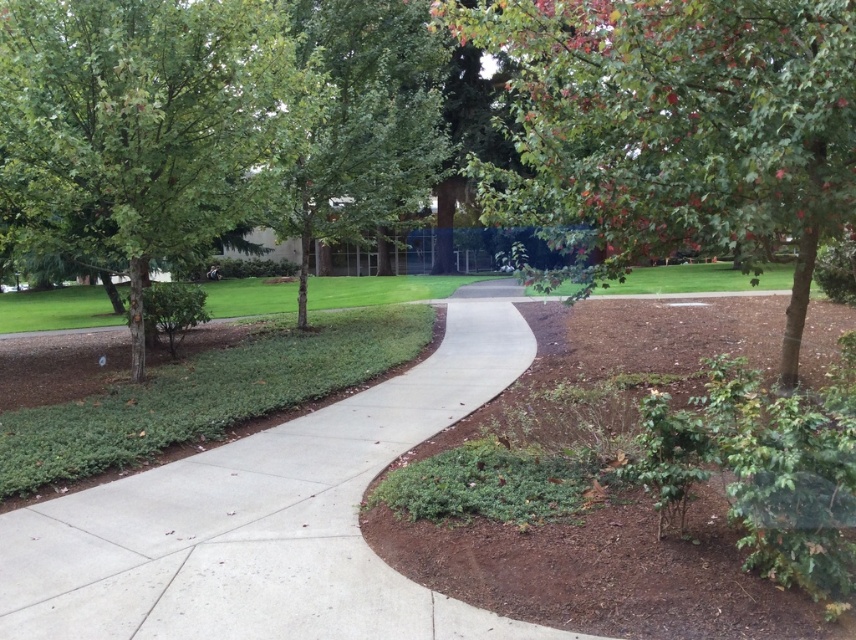
Does green leafy tree at left appear over green leafy tree at center?

Incorrect, green leafy tree at left is not positioned above green leafy tree at center.

Does green leafy tree at left appear under green leafy tree at center?

Yes.

Identify the location of green leafy tree at left. (144, 124).

Find the location of a particular element. This screenshot has width=856, height=640. green leafy tree at left is located at coordinates [144, 124].

Is point (349, 403) closer to viewer compared to point (167, 147)?

That is False.

Does concrete at center appear on the right side of green leafy tree at left?

Indeed, concrete at center is positioned on the right side of green leafy tree at left.

Does point (153, 468) lie in front of point (223, 209)?

That is True.

The image size is (856, 640). Identify the location of concrete at center. (265, 522).

Is green leafy tree at upper right below green leafy tree at left?

No, green leafy tree at upper right is not below green leafy tree at left.

Who is taller, green leafy tree at upper right or green leafy tree at left?

green leafy tree at left

Where is `green leafy tree at upper right`? This screenshot has height=640, width=856. green leafy tree at upper right is located at coordinates (676, 124).